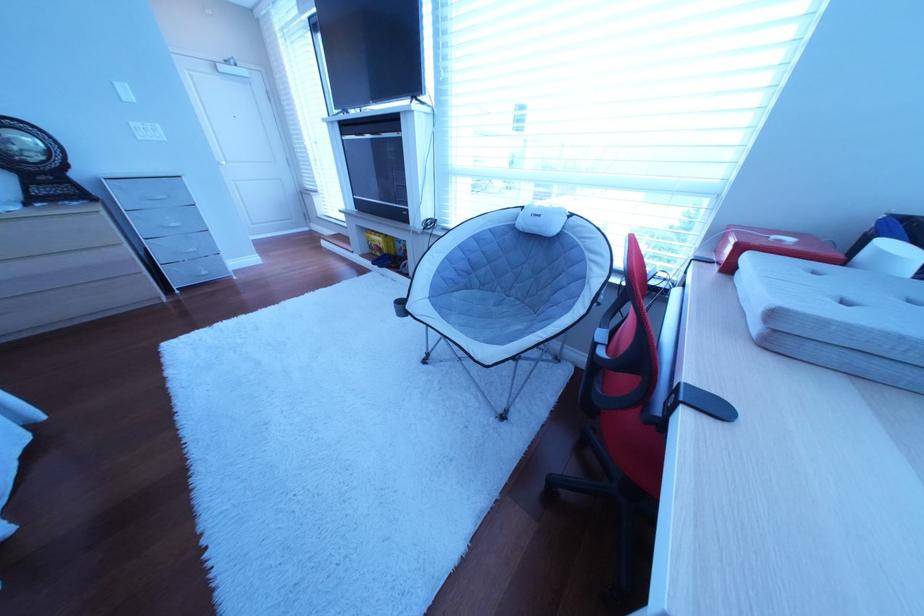
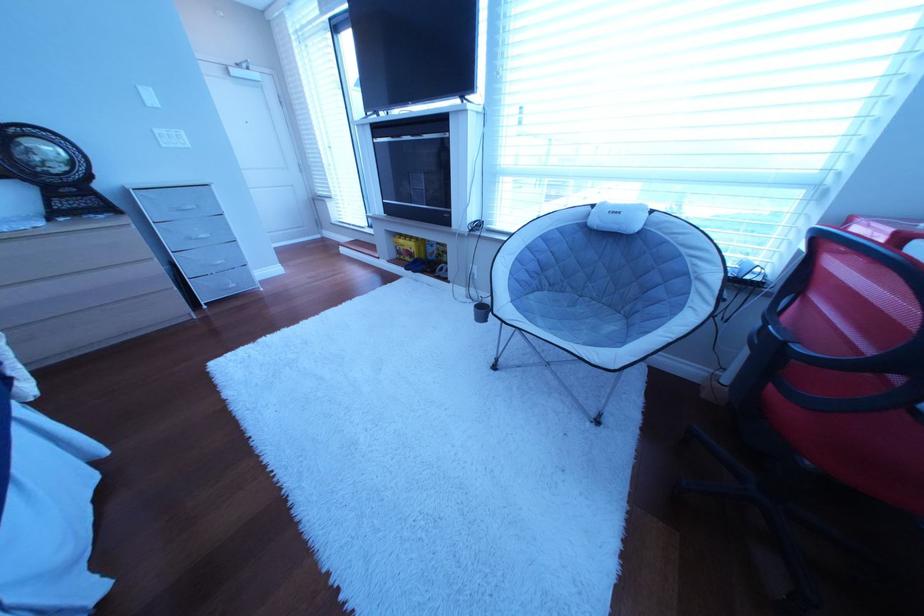
Find the pixel in the second image that matches (x=165, y=201) in the first image.

(193, 213)